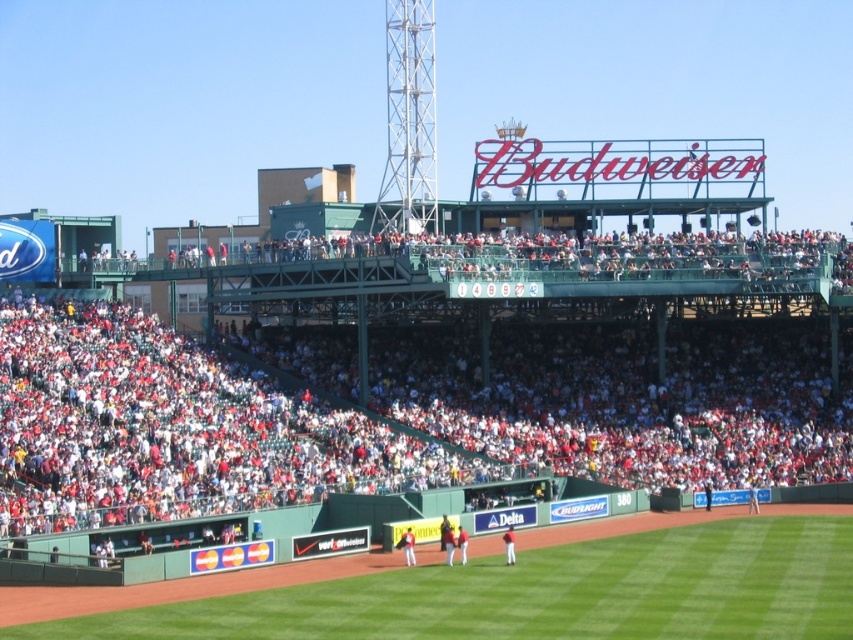
From the picture: You are a photographer standing at the back of the upper tier of the baseball stadium. You want to take a photo that includes both the point at coordinate point (511, 561) and the point at coordinate point (461, 552). Which point will appear larger in your photo?

Point (511, 561) is closer to the camera than point (461, 552), so it will appear larger in the photo.

You are standing at the edge of the baseball field and want to take a photo of the two points mentioned. Which point, point (404, 589) or point (409, 554), will appear larger in your photo?

Point (404, 589) will appear larger in the photo because it is closer to the camera than point (409, 554).